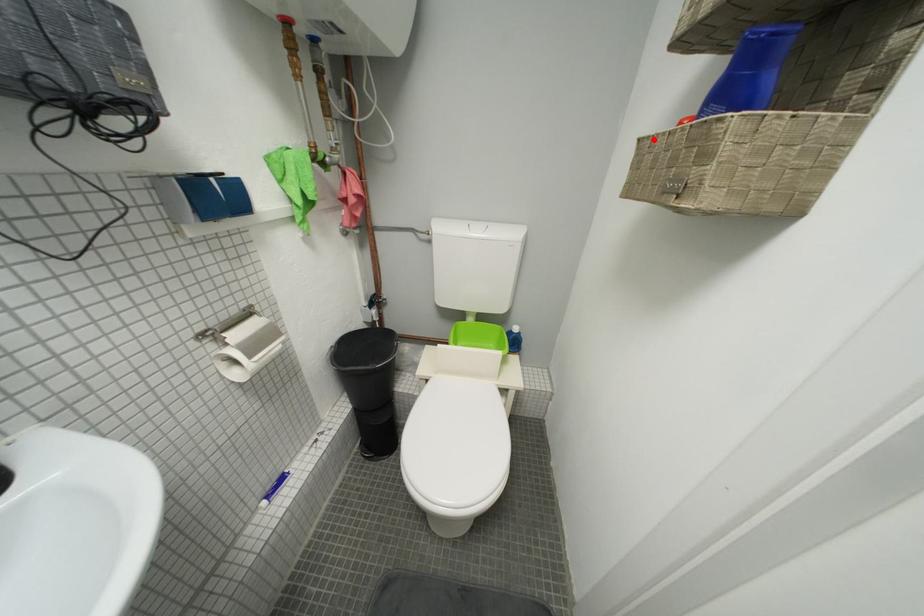
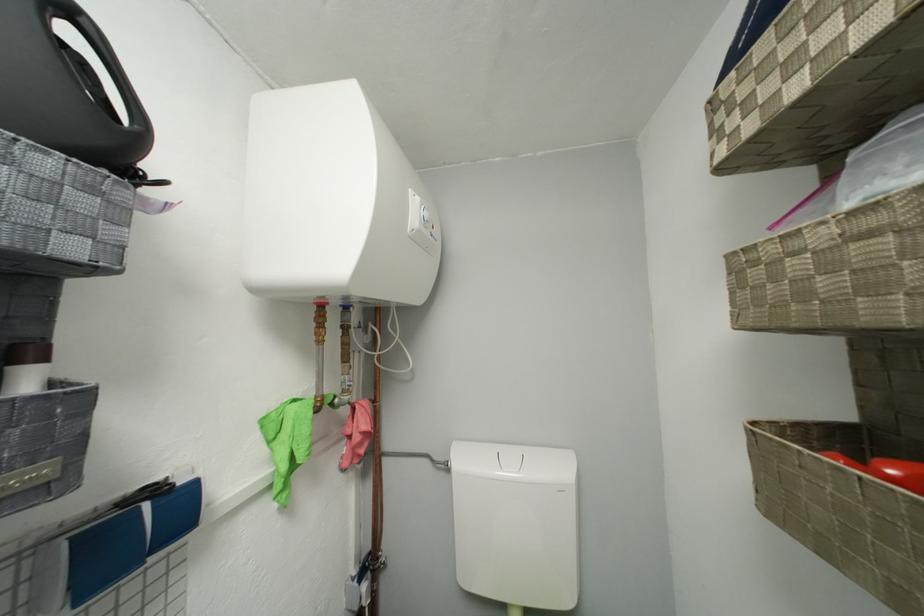
Question: I am providing you with two images of the same scene from different viewpoints. A red point is marked on the first image. Is the red point's position out of view in image 2?

Choices:
 (A) Yes
 (B) No

Answer: (B)